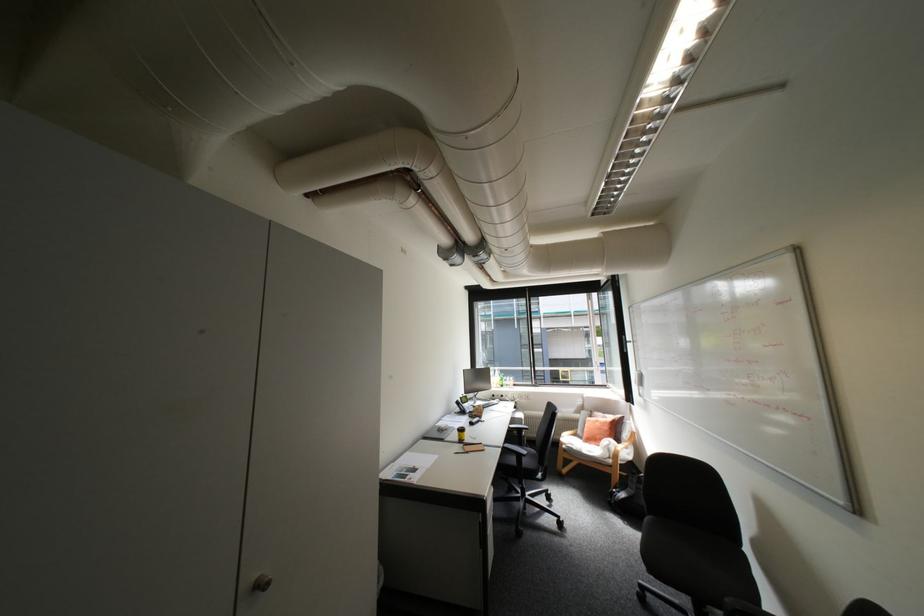
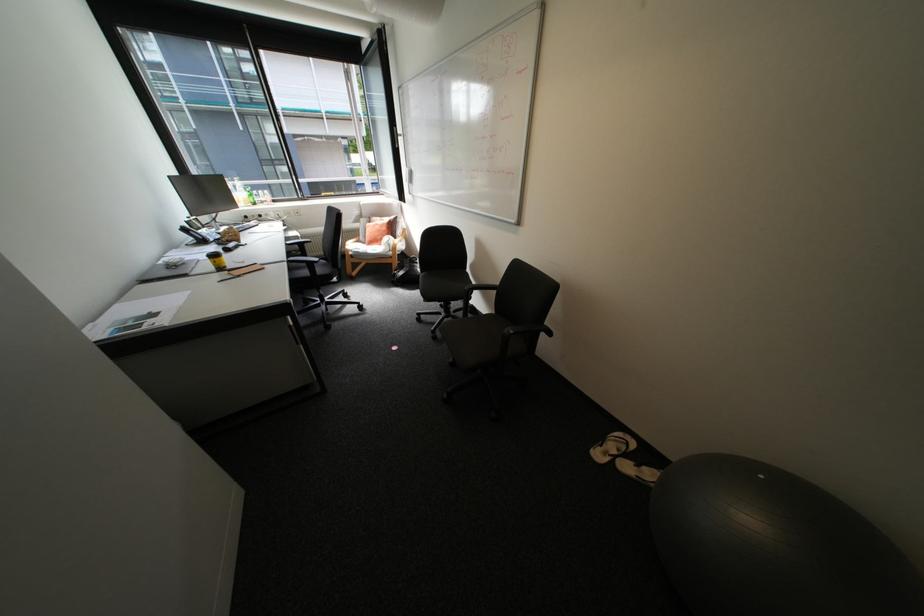
Find the pixel in the second image that matches (618,443) in the first image.

(397, 238)